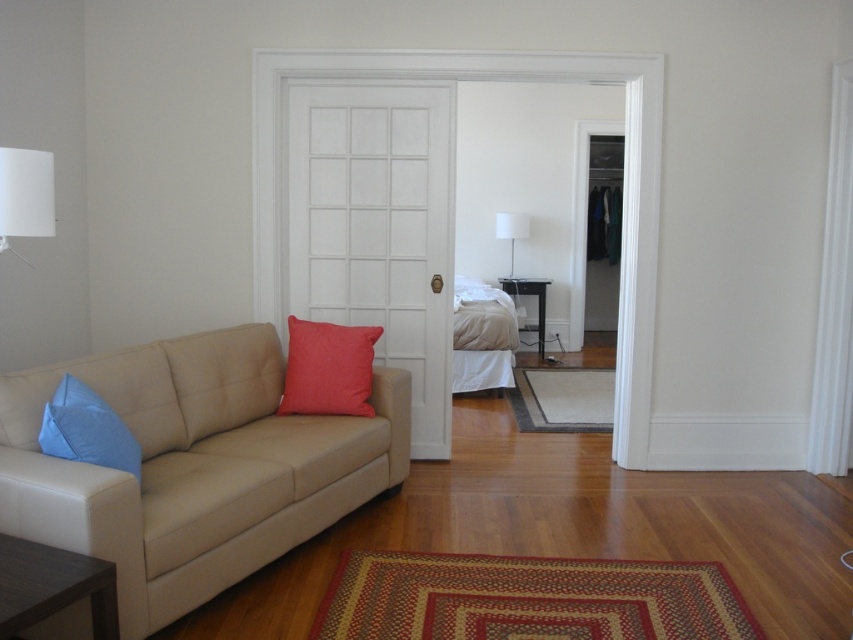
Locate an element on the screen. The width and height of the screenshot is (853, 640). beige leather couch at left is located at coordinates (195, 467).

Between point (251, 563) and point (503, 218), which one is positioned behind?

Point (503, 218)

This screenshot has width=853, height=640. In order to click on beige leather couch at left in this screenshot , I will do `click(195, 467)`.

Does brown wood table at lower left have a larger size compared to white matte lampshade at upper left?

Yes.

Is brown wood table at lower left smaller than white matte lampshade at upper left?

Incorrect, brown wood table at lower left is not smaller in size than white matte lampshade at upper left.

At what (x,y) coordinates should I click in order to perform the action: click on brown wood table at lower left. Please return your answer as a coordinate pair (x, y). The height and width of the screenshot is (640, 853). Looking at the image, I should click on (51, 586).

I want to click on brown wood table at lower left, so click(x=51, y=586).

In the scene shown: Can you confirm if brown wood table at lower left is taller than matte red pillow at center?

In fact, brown wood table at lower left may be shorter than matte red pillow at center.

Does point (109, 625) come closer to viewer compared to point (372, 349)?

Yes, it is.

Identify the location of brown wood table at lower left. (51, 586).

At what (x,y) coordinates should I click in order to perform the action: click on brown wood table at lower left. Please return your answer as a coordinate pair (x, y). Image resolution: width=853 pixels, height=640 pixels. Looking at the image, I should click on (51, 586).